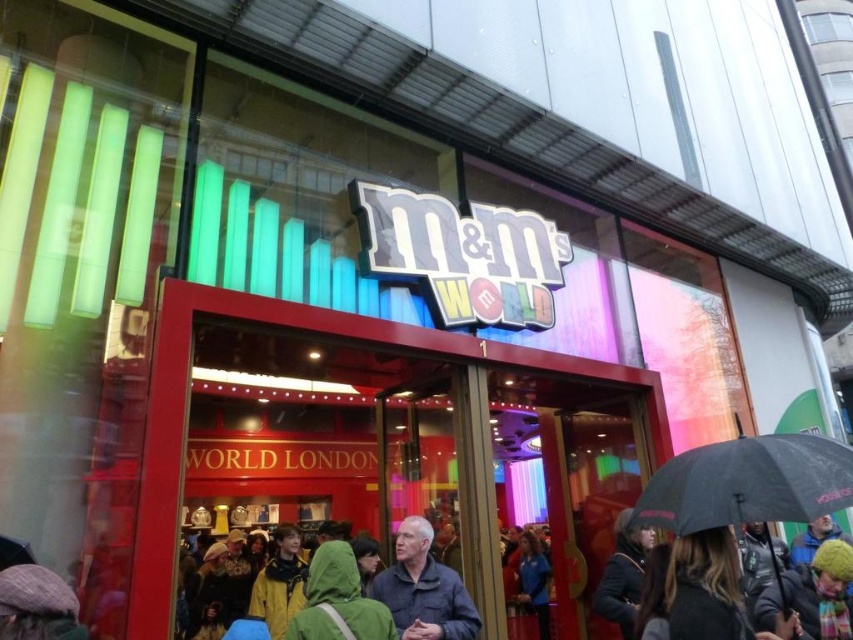
In the scene shown: You are a customer standing outside the M M s World store in London and see the green hooded jacket at center and the black fuzzy hat at lower right. Which object is closer to you?

The green hooded jacket at center is closer to you because it is in front of the black fuzzy hat at lower right.